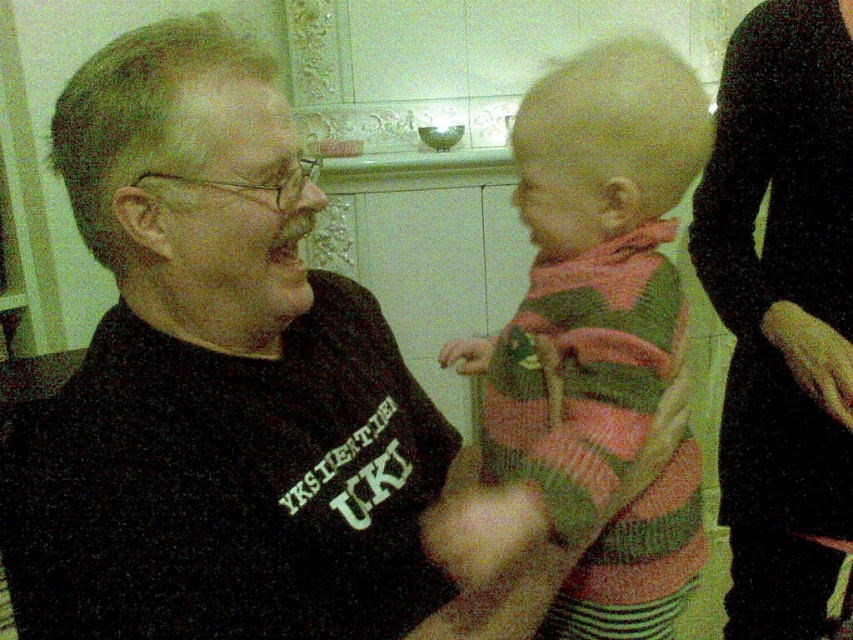
In the scene shown: Does knitted sweater at center appear on the right side of black fabric dress at right?

In fact, knitted sweater at center is to the left of black fabric dress at right.

Find the location of a particular element. This screenshot has height=640, width=853. knitted sweater at center is located at coordinates (578, 307).